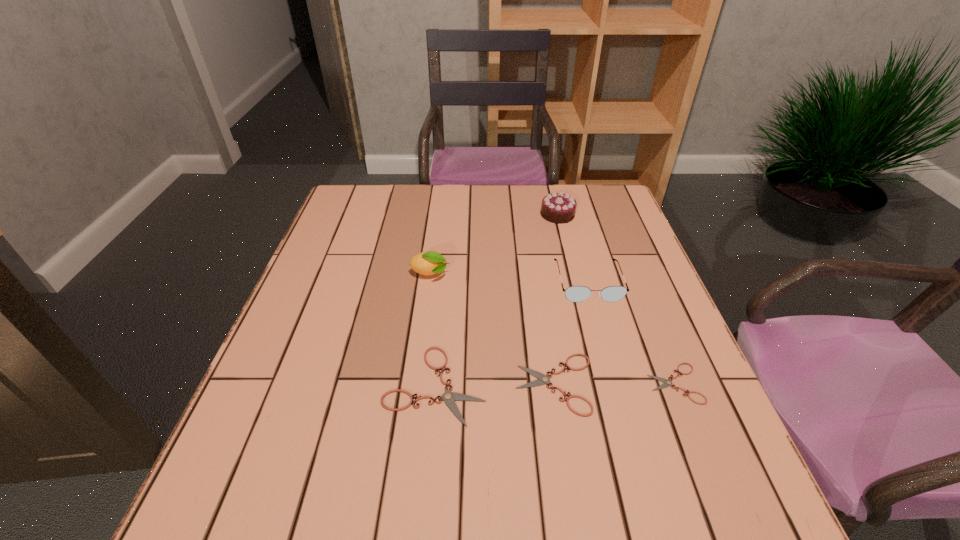
Locate an element on the screen. The image size is (960, 540). the leftmost shears is located at coordinates (449, 397).

Where is `the second tallest shears`? the second tallest shears is located at coordinates (542, 379).

Locate an element on the screen. The image size is (960, 540). the second shortest object is located at coordinates (542, 379).

Where is `the rightmost shears`? the rightmost shears is located at coordinates (667, 383).

Where is `the shortest shears`? This screenshot has width=960, height=540. the shortest shears is located at coordinates (667, 383).

I want to click on the farthest object, so click(x=559, y=208).

Find the location of a particular element. lemon is located at coordinates (428, 263).

Locate an element on the screen. The height and width of the screenshot is (540, 960). spectacles is located at coordinates (574, 293).

Locate an element on the screen. The image size is (960, 540). vacant area located on the back of the leftmost shears is located at coordinates (448, 242).

Locate an element on the screen. The image size is (960, 540). free location located on the left of the second shortest shears is located at coordinates (320, 384).